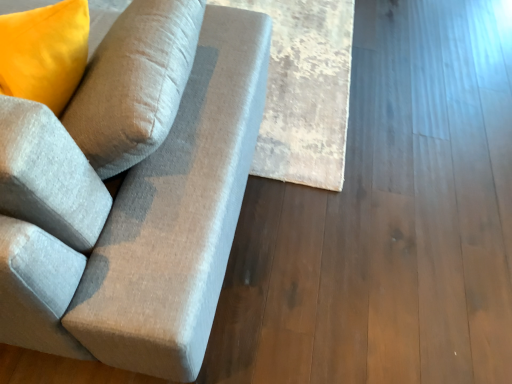
In order to click on beige textured rug at center in this screenshot , I will do `click(305, 91)`.

The image size is (512, 384). What do you see at coordinates (305, 91) in the screenshot? I see `beige textured rug at center` at bounding box center [305, 91].

The width and height of the screenshot is (512, 384). In order to click on textured gray fabric couch at left in this screenshot , I will do `click(179, 213)`.

In order to face textured gray fabric couch at left, should I rotate leftwards or rightwards?

To face it directly, rotate left by 27.846 degrees.

What do you see at coordinates (179, 213) in the screenshot? I see `textured gray fabric couch at left` at bounding box center [179, 213].

Where is `beige textured rug at center`? This screenshot has height=384, width=512. beige textured rug at center is located at coordinates click(x=305, y=91).

Which is more to the right, beige textured rug at center or textured gray fabric couch at left?

From the viewer's perspective, beige textured rug at center appears more on the right side.

From the picture: Is beige textured rug at center in front of or behind textured gray fabric couch at left in the image?

beige textured rug at center is positioned farther from the viewer than textured gray fabric couch at left.

Is point (298, 147) farther from camera compared to point (11, 338)?

Yes, point (298, 147) is farther from viewer.

From the image's perspective, which is below, beige textured rug at center or textured gray fabric couch at left?

textured gray fabric couch at left is shown below in the image.

From a real-world perspective, is beige textured rug at center on top of textured gray fabric couch at left?

No, from a real-world perspective, beige textured rug at center is not above textured gray fabric couch at left.

Considering the sizes of objects beige textured rug at center and textured gray fabric couch at left in the image provided, who is thinner, beige textured rug at center or textured gray fabric couch at left?

With smaller width is beige textured rug at center.

Is beige textured rug at center taller than textured gray fabric couch at left?

In fact, beige textured rug at center may be shorter than textured gray fabric couch at left.

Does beige textured rug at center have a larger size compared to textured gray fabric couch at left?

No.

Is beige textured rug at center surrounding textured gray fabric couch at left?

No.

Is beige textured rug at center in contact with textured gray fabric couch at left?

beige textured rug at center and textured gray fabric couch at left are not in contact.

Is beige textured rug at center oriented away from textured gray fabric couch at left?

No, beige textured rug at center's orientation is not away from textured gray fabric couch at left.

What's the angular difference between beige textured rug at center and textured gray fabric couch at left's facing directions?

They differ by 91.5 degrees in their facing directions.

Locate an element on the screen. plank on the right of textured gray fabric couch at left is located at coordinates (305, 91).

Can you confirm if textured gray fabric couch at left is positioned to the right of beige textured rug at center?

Incorrect, textured gray fabric couch at left is not on the right side of beige textured rug at center.

Which object is further away from the camera, textured gray fabric couch at left or beige textured rug at center?

Positioned behind is beige textured rug at center.

Which is behind, point (137, 337) or point (328, 34)?

The point (328, 34) is farther from the camera.

From the image's perspective, which is above, textured gray fabric couch at left or beige textured rug at center?

beige textured rug at center.

From a real-world perspective, which object stands above the other?

textured gray fabric couch at left.

Which object is wider, textured gray fabric couch at left or beige textured rug at center?

With larger width is textured gray fabric couch at left.

Can you confirm if textured gray fabric couch at left is taller than beige textured rug at center?

Indeed, textured gray fabric couch at left has a greater height compared to beige textured rug at center.

Is textured gray fabric couch at left smaller than beige textured rug at center?

Actually, textured gray fabric couch at left might be larger than beige textured rug at center.

Is textured gray fabric couch at left located outside beige textured rug at center?

Yes, textured gray fabric couch at left is not within beige textured rug at center.

Is textured gray fabric couch at left with beige textured rug at center?

textured gray fabric couch at left is not next to beige textured rug at center, and they're not touching.

Is textured gray fabric couch at left aimed at beige textured rug at center?

Yes, textured gray fabric couch at left is facing beige textured rug at center.

What's the angular difference between textured gray fabric couch at left and beige textured rug at center's facing directions?

91.5 degrees separate the facing orientations of textured gray fabric couch at left and beige textured rug at center.

You are a GUI agent. You are given a task and a screenshot of the screen. Output one action in this format:
    pyautogui.click(x=<x>, y=<y>)
    Task: Click on the studio couch above the beige textured rug at center (from a real-world perspective)
    
    Given the screenshot: What is the action you would take?
    pyautogui.click(x=179, y=213)

The image size is (512, 384). In order to click on plank above the textured gray fabric couch at left (from the image's perspective) in this screenshot , I will do `click(305, 91)`.

This screenshot has width=512, height=384. In order to click on studio couch positioned vertically above the beige textured rug at center (from a real-world perspective) in this screenshot , I will do `click(179, 213)`.